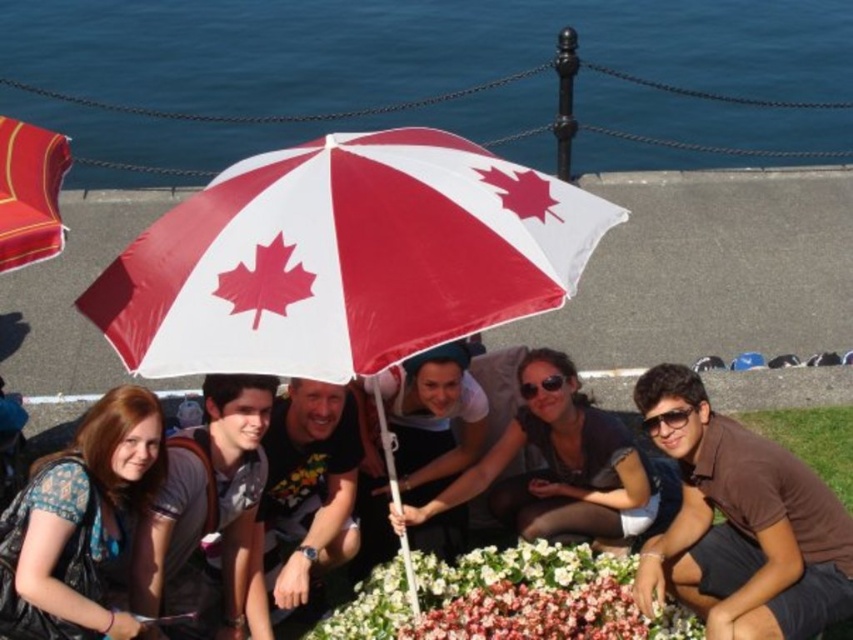
You are a photographer setting up a tripod 1.8 meters tall. You want to capture a photo of the matte black shirt at center and the green grass at lower right in the same frame. Will the tripod height be sufficient to include both in the shot?

The matte black shirt at center and green grass at lower right are 2.45 meters apart from each other. Since the tripod is only 1.8 meters tall, it may not be sufficient to capture both in the same frame as the distance between them exceeds the tripod height.

You are standing at the point marked as point (740,524). What object is located at that exact point?

The brown cotton shirt at lower right is located at point (740,524).